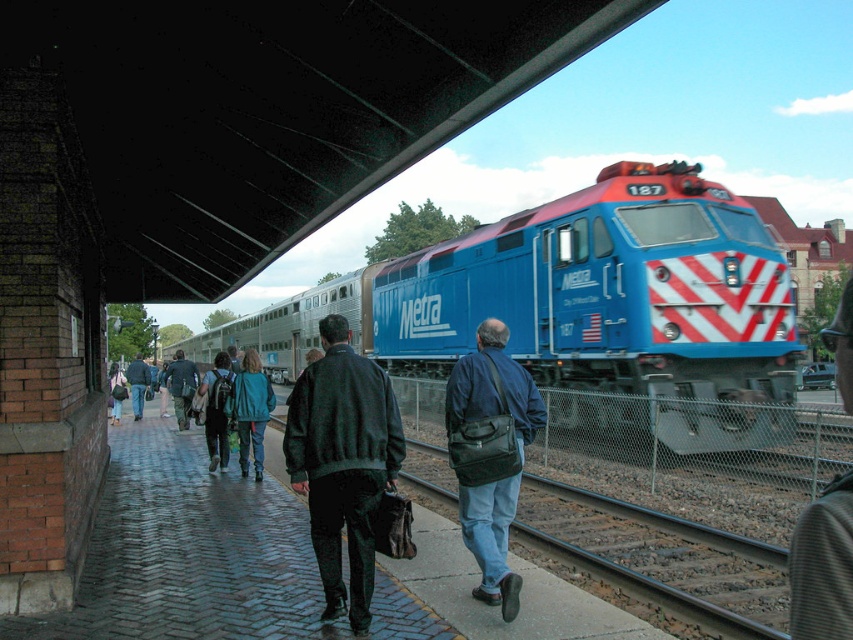
Is dark gray jacket at center further to camera compared to denim jacket at left?

No, it is in front of denim jacket at left.

Which is more to the left, dark gray jacket at center or denim jacket at left?

Positioned to the left is denim jacket at left.

Who is more distant from viewer, (828, 579) or (109, 388)?

The point (109, 388) is more distant.

Find the location of a particular element. Image resolution: width=853 pixels, height=640 pixels. dark gray jacket at center is located at coordinates (822, 564).

Is teal fabric jacket at center wider than dark blue backpack at center?

Indeed, teal fabric jacket at center has a greater width compared to dark blue backpack at center.

In order to click on teal fabric jacket at center in this screenshot , I will do `click(251, 410)`.

Describe the element at coordinates (579, 301) in the screenshot. I see `blue metallic train at center` at that location.

Can you confirm if blue metallic train at center is shorter than dark green jacket at center?

No.

Image resolution: width=853 pixels, height=640 pixels. What do you see at coordinates (579, 301) in the screenshot?
I see `blue metallic train at center` at bounding box center [579, 301].

This screenshot has width=853, height=640. Find the location of `blue metallic train at center`. blue metallic train at center is located at coordinates (579, 301).